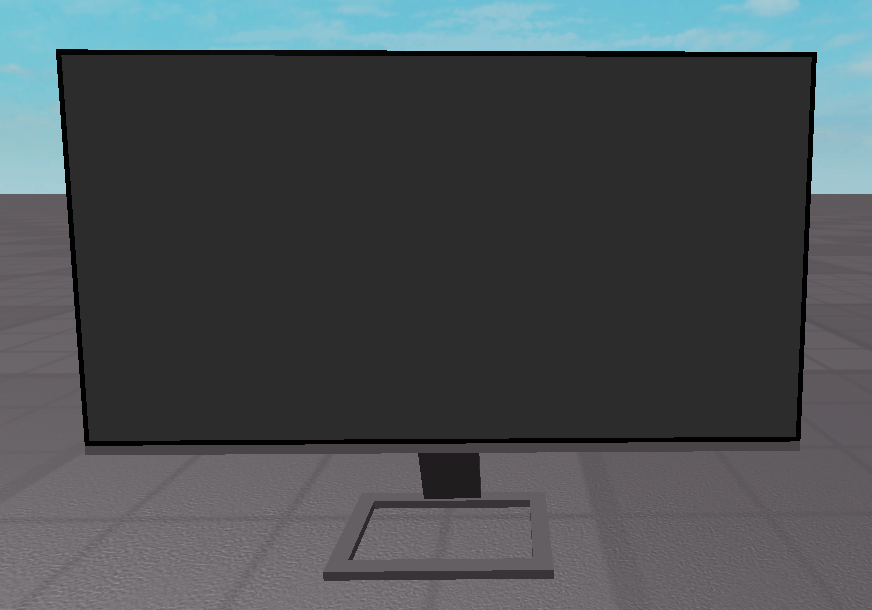
You are a GUI agent. You are given a task and a screenshot of the screen. Output one action in this format:
    pyautogui.click(x=<x>, y=<y>)
    Task: Click on the screen
    The width and height of the screenshot is (872, 610).
    Given the screenshot: What is the action you would take?
    pyautogui.click(x=241, y=331), pyautogui.click(x=704, y=120), pyautogui.click(x=687, y=356), pyautogui.click(x=228, y=149), pyautogui.click(x=454, y=216)